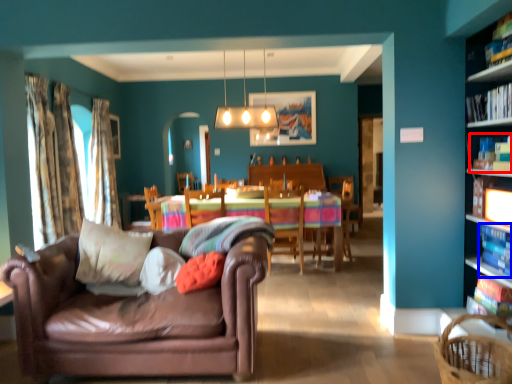
Question: Which point is closer to the camera, book (highlighted by a red box) or book (highlighted by a blue box)?

Choices:
 (A) book
 (B) book

Answer: (B)